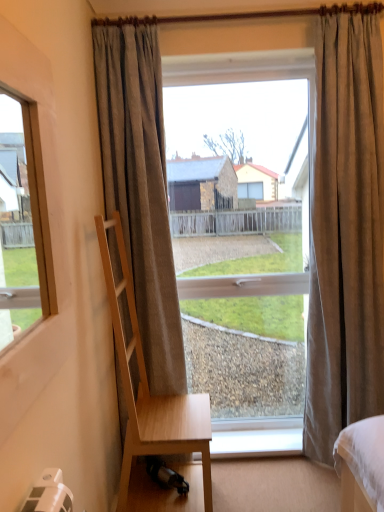
Question: From the image's perspective, is brown textured curtain at right, the 1th curtain positioned from the right, on light wood chair at left?

Choices:
 (A) yes
 (B) no

Answer: (A)

Question: Is brown textured curtain at right, the 1th curtain positioned from the right, in contact with light wood chair at left?

Choices:
 (A) yes
 (B) no

Answer: (B)

Question: Could you tell me if brown textured curtain at right, the 1th curtain positioned from the right, is facing light wood chair at left?

Choices:
 (A) yes
 (B) no

Answer: (B)

Question: Considering the relative sizes of brown textured curtain at right, the 1th curtain positioned from the right, and light wood chair at left in the image provided, is brown textured curtain at right, the 1th curtain positioned from the right, taller than light wood chair at left?

Choices:
 (A) yes
 (B) no

Answer: (A)

Question: From a real-world perspective, is brown textured curtain at right, which is the 2th curtain in left-to-right order, under light wood chair at left?

Choices:
 (A) yes
 (B) no

Answer: (B)

Question: Based on their positions, is clear glass window at center located to the left or right of white plastic window sill at lower center?

Choices:
 (A) right
 (B) left

Answer: (B)

Question: In the image, is clear glass window at center positioned in front of or behind white plastic window sill at lower center?

Choices:
 (A) behind
 (B) front

Answer: (B)

Question: From a real-world perspective, is clear glass window at center above or below white plastic window sill at lower center?

Choices:
 (A) above
 (B) below

Answer: (A)

Question: From the image's perspective, is clear glass window at center located above or below white plastic window sill at lower center?

Choices:
 (A) above
 (B) below

Answer: (A)

Question: From a real-world perspective, is light wood chair at left physically located above or below clear glass window at center?

Choices:
 (A) below
 (B) above

Answer: (A)

Question: Does point (117, 333) appear closer or farther from the camera than point (210, 351)?

Choices:
 (A) farther
 (B) closer

Answer: (B)

Question: In terms of height, does light wood chair at left look taller or shorter compared to clear glass window at center?

Choices:
 (A) short
 (B) tall

Answer: (A)

Question: Is light wood chair at left bigger or smaller than clear glass window at center?

Choices:
 (A) big
 (B) small

Answer: (A)

Question: From a real-world perspective, is light wood chair at left physically located above or below brown textured curtain at right, the 1th curtain positioned from the right?

Choices:
 (A) below
 (B) above

Answer: (A)

Question: From the image's perspective, is light wood chair at left above or below brown textured curtain at right, which is the 2th curtain in left-to-right order?

Choices:
 (A) below
 (B) above

Answer: (A)